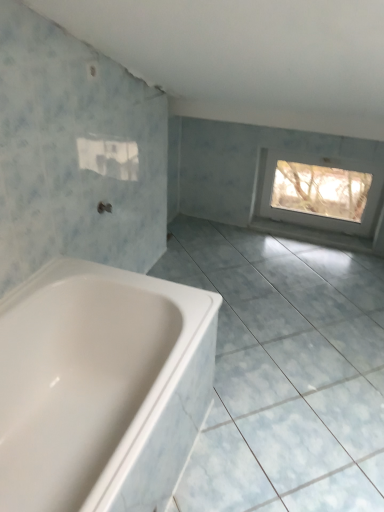
Question: Considering the relative positions of white glossy ceramic tile at lower left and white glossy bathtub at lower left in the image provided, is white glossy ceramic tile at lower left to the left or to the right of white glossy bathtub at lower left?

Choices:
 (A) right
 (B) left

Answer: (A)

Question: Considering the positions of point (256, 508) and point (153, 347), is point (256, 508) closer or farther from the camera than point (153, 347)?

Choices:
 (A) farther
 (B) closer

Answer: (B)

Question: Which of these objects is positioned farthest from the matte silver tap at center?

Choices:
 (A) white glossy bathtub at lower left
 (B) transparent plastic window at upper right
 (C) white glossy ceramic tile at lower left

Answer: (B)

Question: Based on their relative distances, which object is nearer to the matte silver tap at center?

Choices:
 (A) white glossy ceramic tile at lower left
 (B) transparent plastic window at upper right
 (C) white glossy bathtub at lower left

Answer: (C)